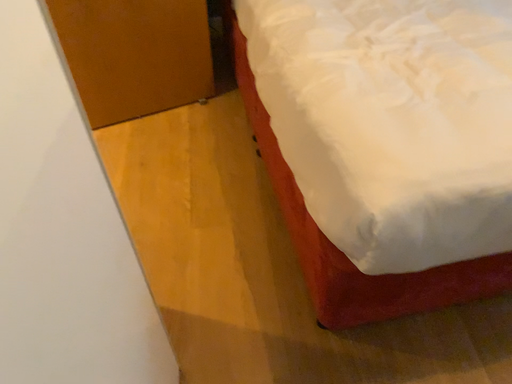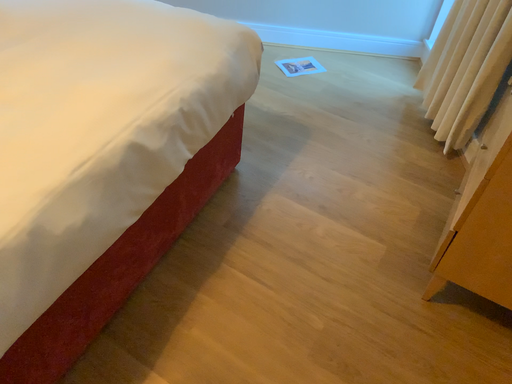
Question: How did the camera likely rotate when shooting the video?

Choices:
 (A) rotated downward
 (B) rotated upward

Answer: (B)